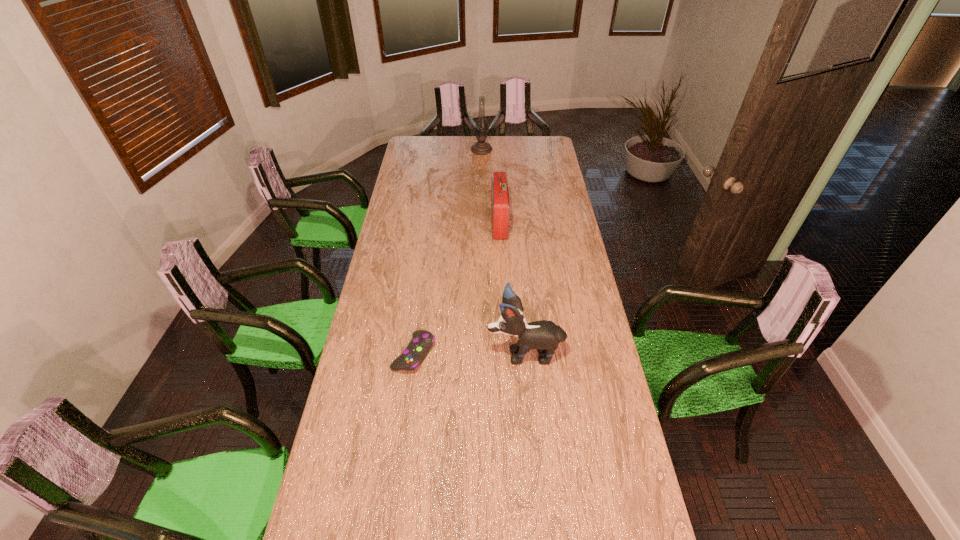
Find the location of a particular element. The width and height of the screenshot is (960, 540). free point between the shortest object and the puppy is located at coordinates (469, 353).

In order to click on vacant area that lies between the puppy and the control in this screenshot , I will do `click(469, 353)`.

This screenshot has width=960, height=540. Identify the location of empty space that is in between the puppy and the farthest object. (x=503, y=252).

The height and width of the screenshot is (540, 960). Find the location of `free spot between the first-aid kit and the farthest object`. free spot between the first-aid kit and the farthest object is located at coordinates (491, 187).

Identify the location of vacant space that is in between the second shortest object and the leftmost object. The image size is (960, 540). click(457, 288).

Identify the location of empty space that is in between the farthest object and the second farthest object. click(x=491, y=187).

This screenshot has height=540, width=960. Find the location of `free space between the farthest object and the puppy`. free space between the farthest object and the puppy is located at coordinates (503, 252).

At what (x,y) coordinates should I click in order to perform the action: click on vacant region between the puppy and the control. Please return your answer as a coordinate pair (x, y). Looking at the image, I should click on (469, 353).

Find the location of `blank region between the puppy and the shortest object`. blank region between the puppy and the shortest object is located at coordinates (469, 353).

The image size is (960, 540). I want to click on object identified as the second closest to the third nearest object, so click(543, 335).